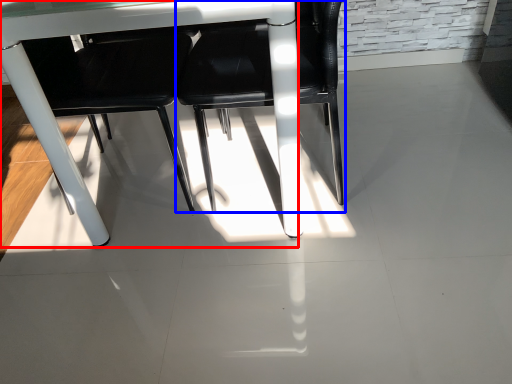
Question: Which object is further to the camera taking this photo, table (highlighted by a red box) or chair (highlighted by a blue box)?

Choices:
 (A) table
 (B) chair

Answer: (B)